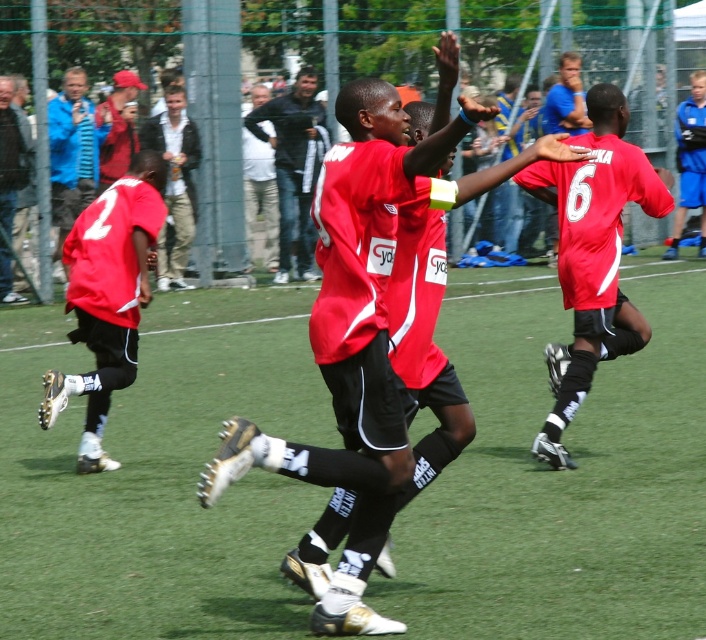
You are a photographer at the soccer match. You want to take a photo that includes both the matte red jersey at center and the matte red jersey at left. Which jersey should you focus on first to ensure both are in frame?

The matte red jersey at center is taller than the matte red jersey at left, so focus on the matte red jersey at center first to ensure both are in frame.

You are a soccer coach standing on the sideline. You want to quickly move from your current position to the matte red jersey at center to give instructions. However, there is a matte red jersey at left blocking your path. Can you walk around them without getting too close? The minimum safe distance for passing is 1.5 meters.

The distance between the matte red jersey at center and the matte red jersey at left is 2.52 meters. Since the minimum safe distance required is 1.5 meters, you can safely walk around the matte red jersey at left while maintaining the required distance to reach the matte red jersey at center.